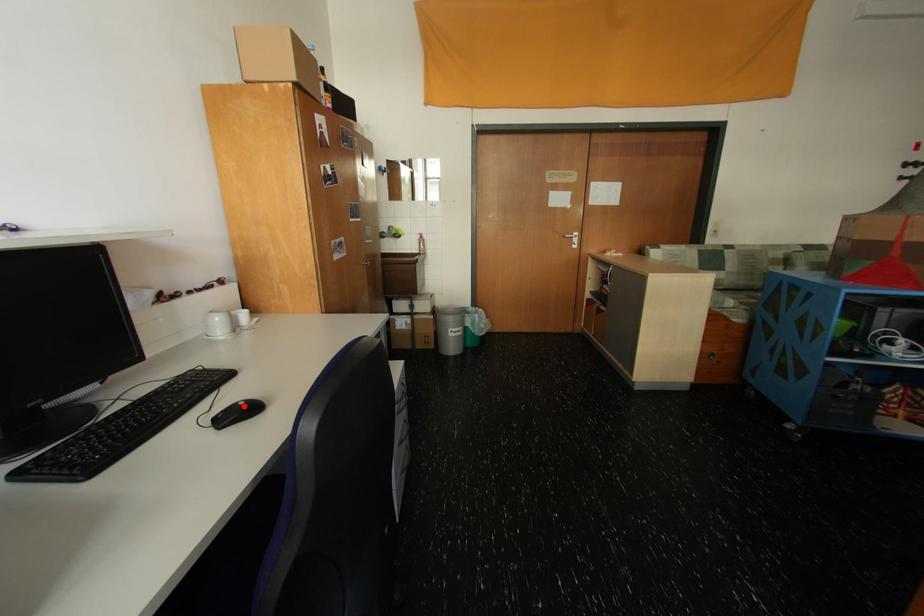
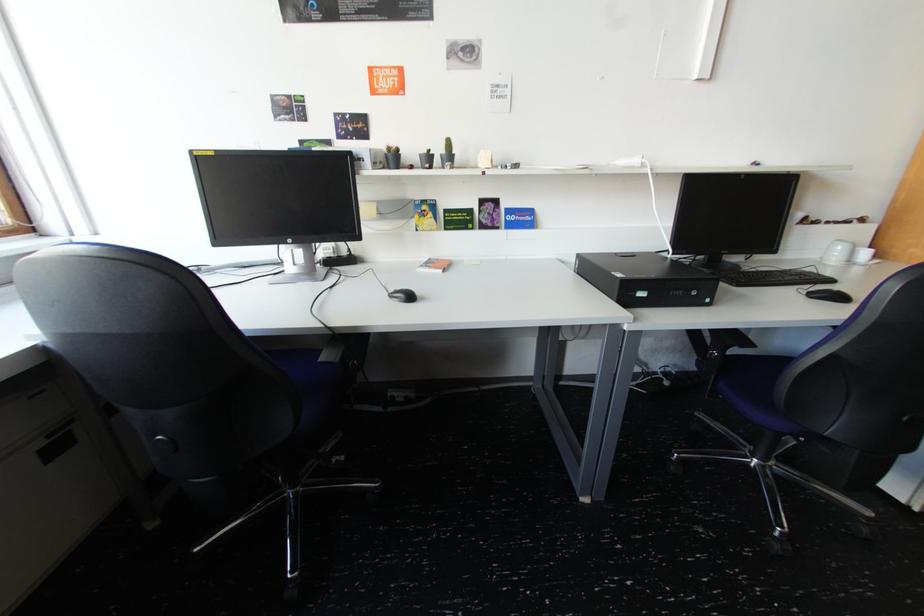
Question: I am providing you with two images of the same scene from different viewpoints. A red point is shown in image1. For the corresponding object point in image2, is it positioned nearer or farther from the camera?

Choices:
 (A) Nearer
 (B) Farther

Answer: (B)